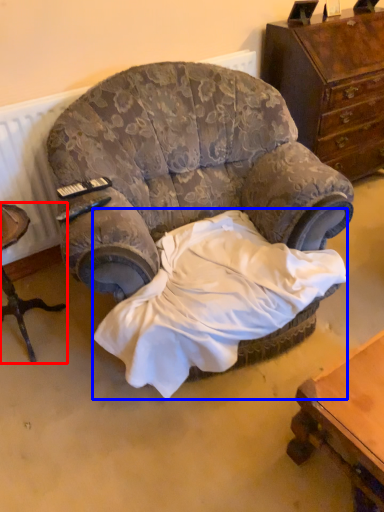
Question: Among these objects, which one is nearest to the camera, furniture (highlighted by a red box) or sheet (highlighted by a blue box)?

Choices:
 (A) furniture
 (B) sheet

Answer: (B)